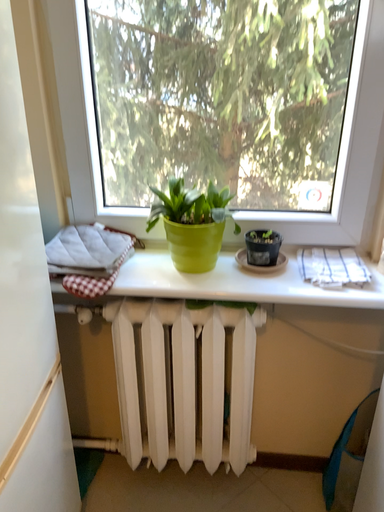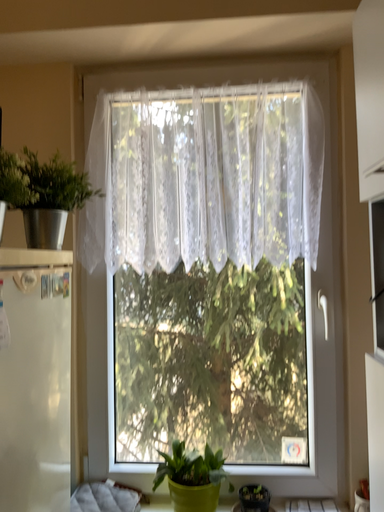
Question: Which way did the camera rotate in the video?

Choices:
 (A) rotated upward
 (B) rotated downward

Answer: (A)